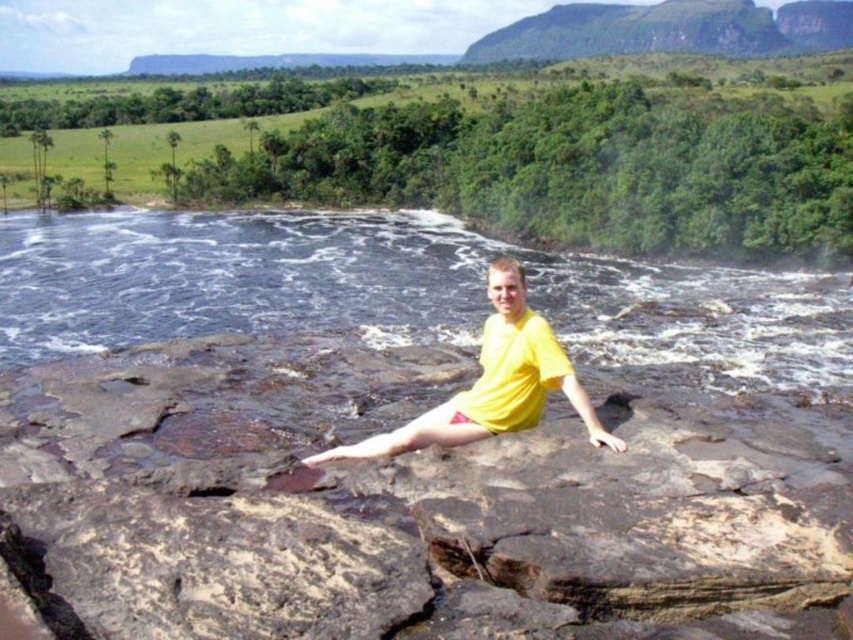
Which of these two, black water at center or yellow matte shirt at center, stands shorter?

yellow matte shirt at center

Find the location of a particular element. black water at center is located at coordinates point(402,292).